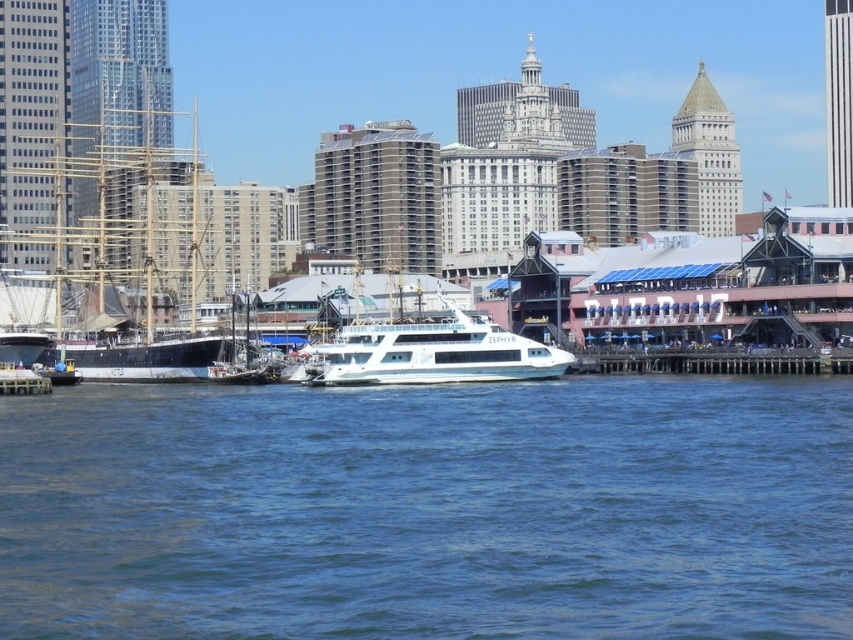
Question: Does blue liquid water at lower center appear on the left side of wooden ship at left?

Choices:
 (A) yes
 (B) no

Answer: (B)

Question: Is blue liquid water at lower center bigger than wooden ship at left?

Choices:
 (A) yes
 (B) no

Answer: (B)

Question: Is blue liquid water at lower center to the left of wooden ship at left from the viewer's perspective?

Choices:
 (A) no
 (B) yes

Answer: (A)

Question: Which point is closer to the camera taking this photo?

Choices:
 (A) (113, 173)
 (B) (364, 358)
 (C) (373, 580)

Answer: (C)

Question: Among these points, which one is nearest to the camera?

Choices:
 (A) (492, 326)
 (B) (74, 356)

Answer: (A)

Question: Which object appears farthest from the camera in this image?

Choices:
 (A) wooden ship at left
 (B) white glossy ferry at center
 (C) blue liquid water at lower center

Answer: (A)